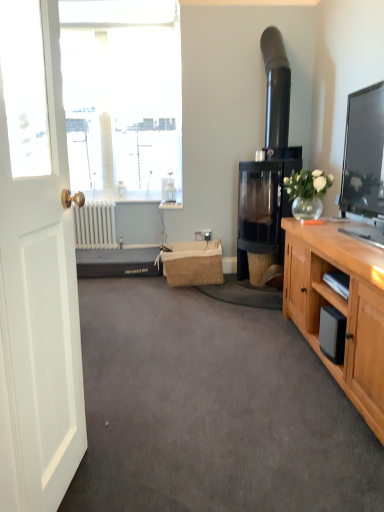
Locate an element on the screen. This screenshot has width=384, height=512. free space in front of burlap picnic basket at center is located at coordinates (203, 294).